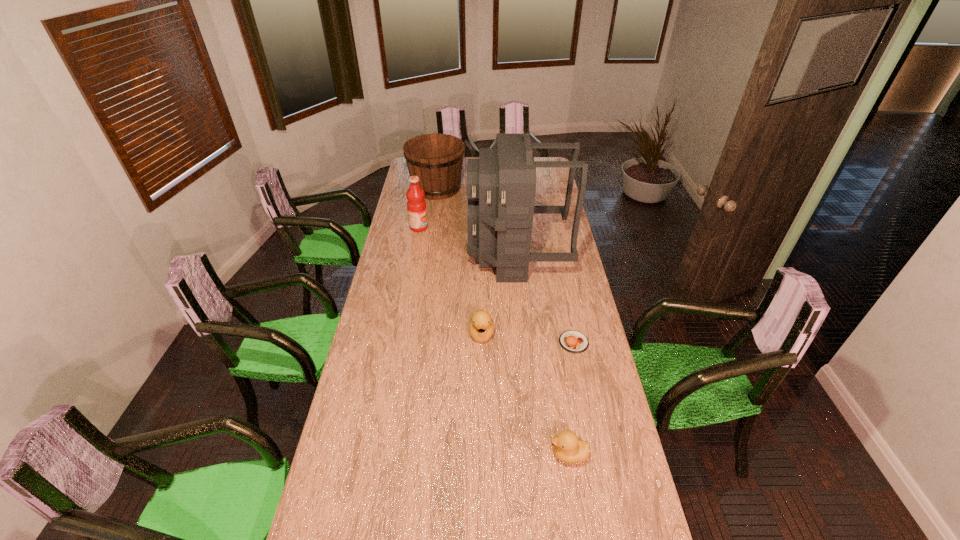
The width and height of the screenshot is (960, 540). Find the location of `fruit juice present at the left edge`. fruit juice present at the left edge is located at coordinates (416, 206).

I want to click on duckling that is positioned at the right edge, so click(x=567, y=448).

Where is `backpack positioned at the right edge`? backpack positioned at the right edge is located at coordinates (501, 184).

Identify the location of patty (food) at the right edge. point(572,341).

Find the location of a particular element. The image size is (960, 540). object that is at the far left corner is located at coordinates (437, 159).

The width and height of the screenshot is (960, 540). In the image, there is a desktop. What are the coordinates of `free region at the left edge` in the screenshot? It's located at (357, 462).

Where is `free space at the right edge of the desktop`? The height and width of the screenshot is (540, 960). free space at the right edge of the desktop is located at coordinates (546, 183).

Image resolution: width=960 pixels, height=540 pixels. In the image, there is a desktop. Find the location of `vacant space at the near left corner`. vacant space at the near left corner is located at coordinates (352, 482).

This screenshot has width=960, height=540. Identify the location of vacant space that is in between the fruit juice and the nearest object. (493, 341).

Identify the location of empty location between the tallest object and the taller duckling. This screenshot has width=960, height=540. (499, 294).